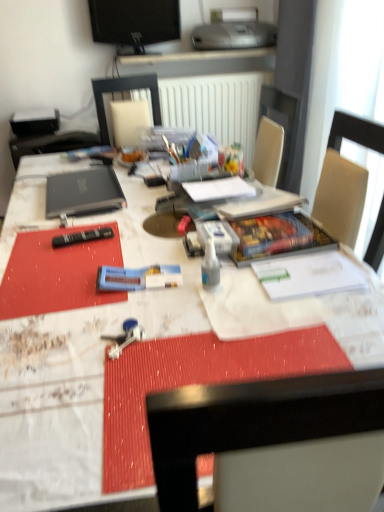
Question: Is black matte laptop at left facing towards silver metallic printer at upper center?

Choices:
 (A) no
 (B) yes

Answer: (A)

Question: Is black matte laptop at left to the right of silver metallic printer at upper center from the viewer's perspective?

Choices:
 (A) no
 (B) yes

Answer: (A)

Question: Is black matte laptop at left far from silver metallic printer at upper center?

Choices:
 (A) yes
 (B) no

Answer: (A)

Question: Considering the relative sizes of black matte laptop at left and silver metallic printer at upper center in the image provided, is black matte laptop at left smaller than silver metallic printer at upper center?

Choices:
 (A) no
 (B) yes

Answer: (B)

Question: Does black matte laptop at left have a greater height compared to silver metallic printer at upper center?

Choices:
 (A) yes
 (B) no

Answer: (B)

Question: Based on their sizes in the image, would you say blue plastic toothpaste tube at center is bigger or smaller than silver metallic printer at upper center?

Choices:
 (A) big
 (B) small

Answer: (B)

Question: From a real-world perspective, is blue plastic toothpaste tube at center physically located above or below silver metallic printer at upper center?

Choices:
 (A) below
 (B) above

Answer: (A)

Question: Does point (162, 274) appear closer or farther from the camera than point (193, 32)?

Choices:
 (A) farther
 (B) closer

Answer: (B)

Question: In terms of width, does blue plastic toothpaste tube at center look wider or thinner when compared to silver metallic printer at upper center?

Choices:
 (A) wide
 (B) thin

Answer: (B)

Question: In terms of height, does white glossy desk at center look taller or shorter compared to transparent plastic bottle at center?

Choices:
 (A) short
 (B) tall

Answer: (B)

Question: From a real-world perspective, is white glossy desk at center physically located above or below transparent plastic bottle at center?

Choices:
 (A) above
 (B) below

Answer: (B)

Question: Relative to transparent plastic bottle at center, is white glossy desk at center in front or behind?

Choices:
 (A) front
 (B) behind

Answer: (A)

Question: From the image's perspective, relative to transparent plastic bottle at center, is white glossy desk at center above or below?

Choices:
 (A) above
 (B) below

Answer: (B)

Question: Would you say transparent plastic bottle at center is inside or outside black matte laptop at left?

Choices:
 (A) inside
 (B) outside

Answer: (B)

Question: Is transparent plastic bottle at center wider or thinner than black matte laptop at left?

Choices:
 (A) wide
 (B) thin

Answer: (B)